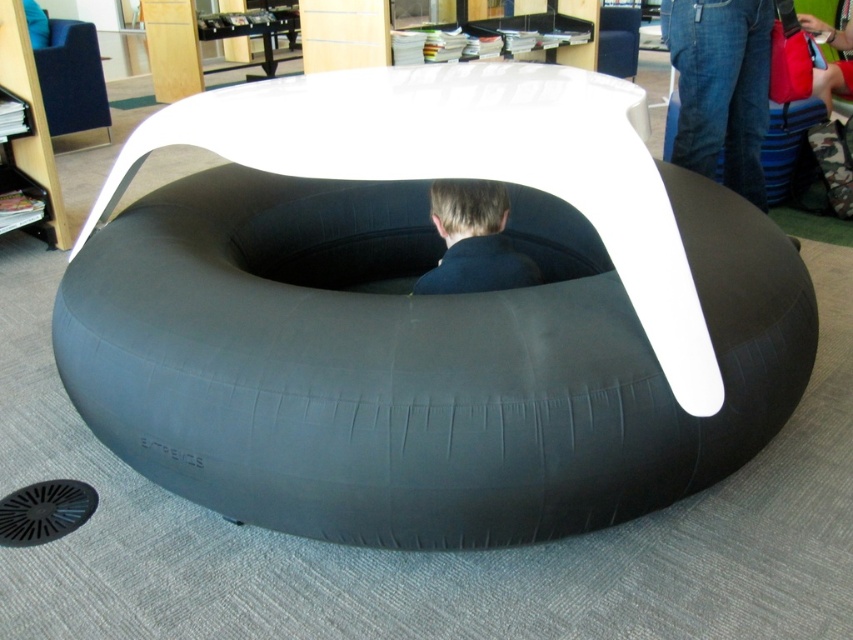
Between jeans at center and matte black bean bag chair at upper left, which one appears on the left side from the viewer's perspective?

Positioned to the left is matte black bean bag chair at upper left.

Is jeans at center taller than matte black bean bag chair at upper left?

Indeed, jeans at center has a greater height compared to matte black bean bag chair at upper left.

Which is behind, point (726, 106) or point (38, 65)?

The point (38, 65) is behind.

The height and width of the screenshot is (640, 853). I want to click on jeans at center, so click(721, 86).

Does jeans at center come in front of dark blue fabric at center?

No.

Can you confirm if jeans at center is positioned to the right of dark blue fabric at center?

Yes, jeans at center is to the right of dark blue fabric at center.

Who is more distant from viewer, (756, 160) or (421, 285)?

The point (756, 160) is more distant.

Where is `jeans at center`? The image size is (853, 640). jeans at center is located at coordinates (721, 86).

Can you confirm if dark blue fabric at center is positioned below matte black bean bag chair at upper left?

Indeed, dark blue fabric at center is positioned under matte black bean bag chair at upper left.

Is dark blue fabric at center positioned before matte black bean bag chair at upper left?

Yes, it is.

Is point (491, 257) closer to viewer compared to point (73, 86)?

That is True.

At what (x,y) coordinates should I click in order to perform the action: click on dark blue fabric at center. Please return your answer as a coordinate pair (x, y). This screenshot has height=640, width=853. Looking at the image, I should click on coord(473,241).